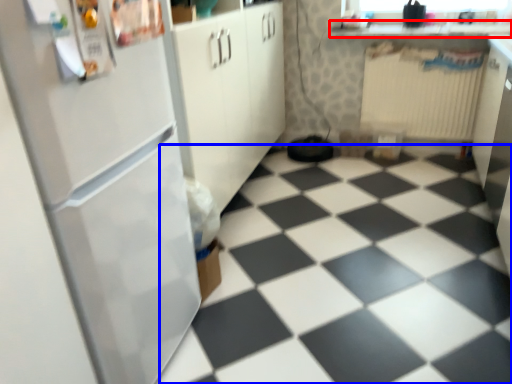
Question: Which of the following is the farthest to the observer, counter top (highlighted by a red box) or tile (highlighted by a blue box)?

Choices:
 (A) counter top
 (B) tile

Answer: (A)